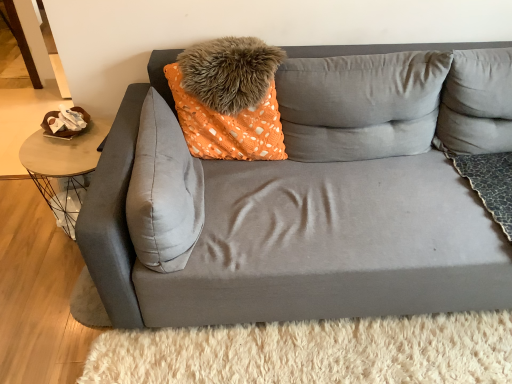
Locate an element on the screen. This screenshot has width=512, height=384. vacant space in front of metallic wire table at left is located at coordinates (40, 278).